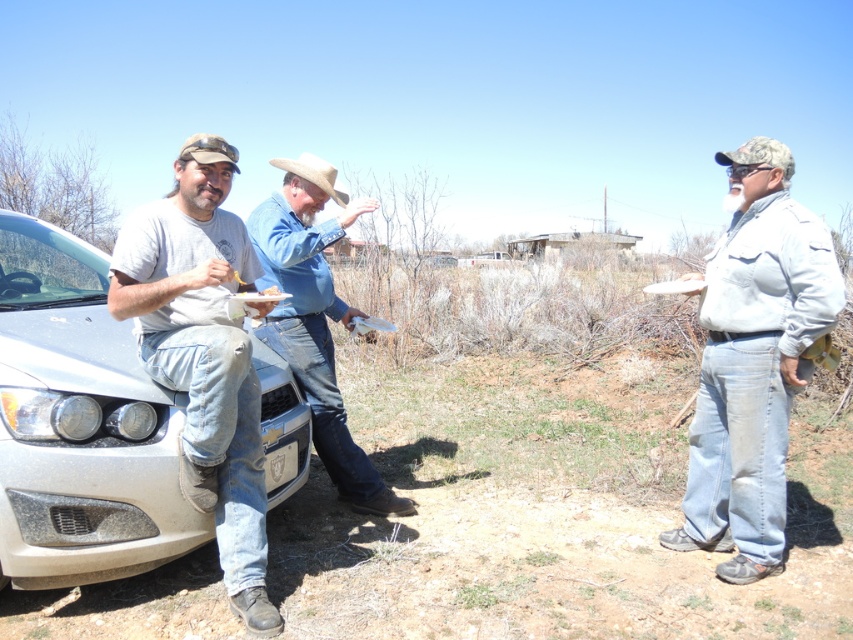
You are planning to wear the denim jacket at right and the beige felt cowboy hat at center. Which item would you need to adjust more to ensure a proper fit?

The denim jacket at right has a smaller size compared to the beige felt cowboy hat at center, so the denim jacket at right would require more adjustment for a proper fit due to its smaller size.

You are planning to place a small book on either the denim jacket at right or the beige felt cowboy hat at center. Based on their sizes, which object would be a more stable surface for the book?

The beige felt cowboy hat at center has a larger width than the denim jacket at right, so placing the book on the beige felt cowboy hat at center would provide a more stable surface.